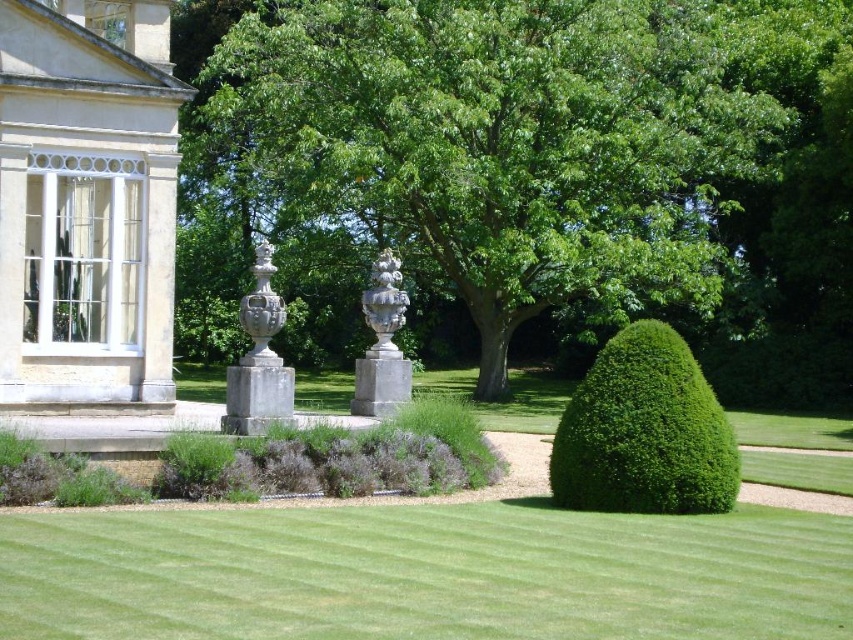
Question: Among these objects, which one is farthest from the camera?

Choices:
 (A) white marble vase at center
 (B) beige stone gazebo at upper left
 (C) green leafy bush at lower right
 (D) green smooth lawn at center

Answer: (B)

Question: Is green leafy tree at center above green smooth lawn at center?

Choices:
 (A) no
 (B) yes

Answer: (B)

Question: Observing the image, what is the correct spatial positioning of green leafy bush at lower right in reference to white stone vase at center?

Choices:
 (A) right
 (B) left

Answer: (A)

Question: Which object is closer to the camera taking this photo?

Choices:
 (A) white marble vase at center
 (B) beige stone gazebo at upper left
 (C) white stone vase at center

Answer: (A)

Question: From the image, what is the correct spatial relationship of green leafy bush at lower right in relation to white marble vase at center?

Choices:
 (A) right
 (B) left

Answer: (A)

Question: Among these objects, which one is farthest from the camera?

Choices:
 (A) beige stone gazebo at upper left
 (B) green smooth lawn at center
 (C) white marble vase at center

Answer: (A)